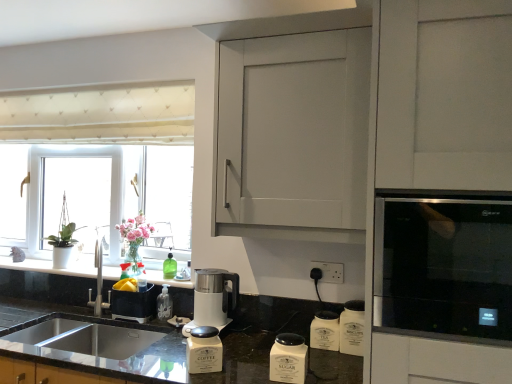
Question: Would you say white ceramic canisters at lower center, which is the fifth appliance from left to right, is outside white matte coffee container at lower center, marked as the 3th appliance in a left-to-right arrangement?

Choices:
 (A) no
 (B) yes

Answer: (B)

Question: From the image's perspective, does white ceramic canisters at lower center, which is the 2th appliance from right to left, appear higher than white matte coffee container at lower center, marked as the 3th appliance in a left-to-right arrangement?

Choices:
 (A) yes
 (B) no

Answer: (B)

Question: Is white ceramic canisters at lower center, which is the 2th appliance from right to left, taller than white matte coffee container at lower center, marked as the 3th appliance in a left-to-right arrangement?

Choices:
 (A) no
 (B) yes

Answer: (B)

Question: Would you consider white ceramic canisters at lower center, which is the 2th appliance from right to left, to be distant from white matte coffee container at lower center, marked as the 3th appliance in a left-to-right arrangement?

Choices:
 (A) yes
 (B) no

Answer: (B)

Question: Is white ceramic canisters at lower center, which is the fifth appliance from left to right, at the left side of white matte coffee container at lower center, marked as the 3th appliance in a left-to-right arrangement?

Choices:
 (A) no
 (B) yes

Answer: (A)

Question: Is white ceramic canisters at lower center, which is the 2th appliance from right to left, with white matte coffee container at lower center, the fourth appliance when ordered from right to left?

Choices:
 (A) no
 (B) yes

Answer: (A)

Question: Considering the relative sizes of white matte sugar container at lower center, the fourth appliance viewed from the left, and white plastic window at left in the image provided, is white matte sugar container at lower center, the fourth appliance viewed from the left, bigger than white plastic window at left?

Choices:
 (A) yes
 (B) no

Answer: (B)

Question: From the image's perspective, is white matte sugar container at lower center, marked as the 3th appliance in a right-to-left arrangement, under white plastic window at left?

Choices:
 (A) yes
 (B) no

Answer: (A)

Question: Are white matte sugar container at lower center, marked as the 3th appliance in a right-to-left arrangement, and white plastic window at left located far from each other?

Choices:
 (A) yes
 (B) no

Answer: (A)

Question: Considering the relative sizes of white matte sugar container at lower center, the fourth appliance viewed from the left, and white plastic window at left in the image provided, is white matte sugar container at lower center, the fourth appliance viewed from the left, thinner than white plastic window at left?

Choices:
 (A) yes
 (B) no

Answer: (A)

Question: Considering the relative positions of white matte sugar container at lower center, the fourth appliance viewed from the left, and white plastic window at left in the image provided, is white matte sugar container at lower center, the fourth appliance viewed from the left, to the right of white plastic window at left from the viewer's perspective?

Choices:
 (A) no
 (B) yes

Answer: (B)

Question: Is white matte sugar container at lower center, the fourth appliance viewed from the left, shorter than white plastic window at left?

Choices:
 (A) yes
 (B) no

Answer: (A)

Question: Does stainless steel sink at lower left appear on the left side of white matte sugar container at lower center, the fourth appliance viewed from the left?

Choices:
 (A) no
 (B) yes

Answer: (B)